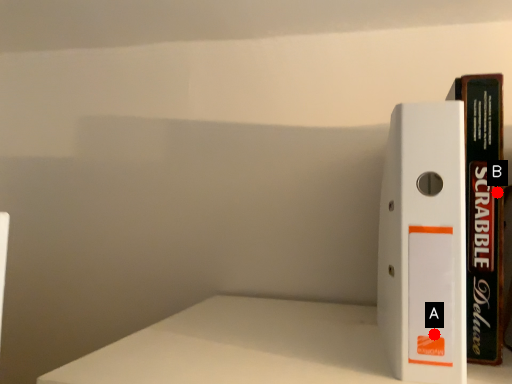
Question: Two points are circled on the image, labeled by A and B beside each circle. Among these points, which one is farthest from the camera?

Choices:
 (A) A is further
 (B) B is further

Answer: (B)